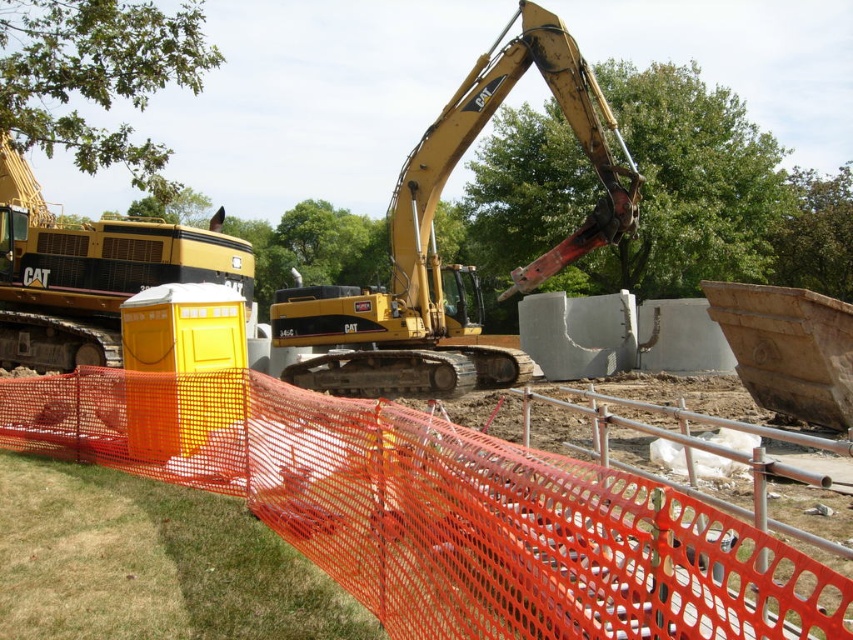
Does orange mesh fence at center appear over yellow metallic excavator at center?

Incorrect, orange mesh fence at center is not positioned above yellow metallic excavator at center.

Is orange mesh fence at center positioned at the back of yellow metallic excavator at center?

That is False.

Is point (65, 420) in front of point (425, 140)?

Yes, it is.

Image resolution: width=853 pixels, height=640 pixels. I want to click on orange mesh fence at center, so click(440, 512).